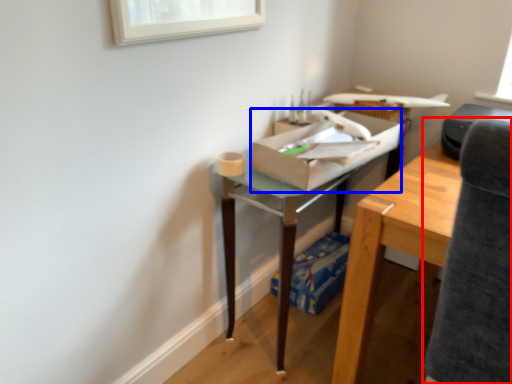
Question: Which of the following is the closest to the observer, swivel chair (highlighted by a red box) or cardboard box (highlighted by a blue box)?

Choices:
 (A) swivel chair
 (B) cardboard box

Answer: (A)